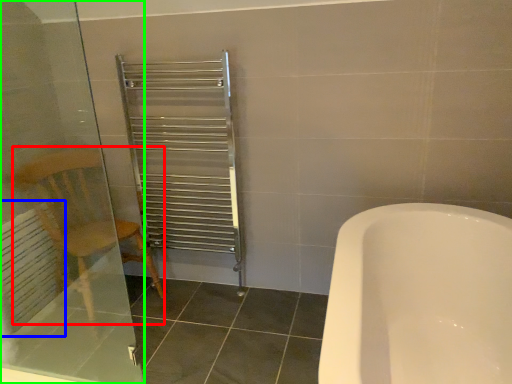
Question: Based on their relative distances, which object is farther from armchair (highlighted by a red box)? Choose from radiator (highlighted by a blue box) and screen door (highlighted by a green box).

Choices:
 (A) radiator
 (B) screen door

Answer: (A)